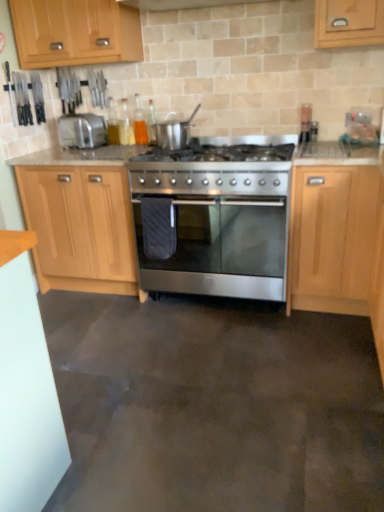
Question: Is stainless steel gas stove at center facing away from glossy wood cabinet at center, which is counted as the first cabinetry, starting from the right?

Choices:
 (A) yes
 (B) no

Answer: (B)

Question: From a real-world perspective, is stainless steel gas stove at center located higher than glossy wood cabinet at center, which is counted as the first cabinetry, starting from the right?

Choices:
 (A) no
 (B) yes

Answer: (B)

Question: From the image's perspective, is stainless steel gas stove at center over glossy wood cabinet at center, which is counted as the first cabinetry, starting from the right?

Choices:
 (A) no
 (B) yes

Answer: (B)

Question: Is stainless steel gas stove at center smaller than glossy wood cabinet at center, which is counted as the third cabinetry, starting from the left?

Choices:
 (A) yes
 (B) no

Answer: (A)

Question: Is the position of stainless steel gas stove at center less distant than that of glossy wood cabinet at center, which is counted as the third cabinetry, starting from the left?

Choices:
 (A) yes
 (B) no

Answer: (B)

Question: Is glossy wood cabinet at center, which is counted as the first cabinetry, starting from the right, a part of stainless steel gas stove at center?

Choices:
 (A) no
 (B) yes

Answer: (A)

Question: Does satin silver pot at center come in front of silver metallic toaster at left?

Choices:
 (A) yes
 (B) no

Answer: (A)

Question: Considering the relative sizes of satin silver pot at center and silver metallic toaster at left in the image provided, is satin silver pot at center taller than silver metallic toaster at left?

Choices:
 (A) no
 (B) yes

Answer: (B)

Question: Is silver metallic toaster at left completely or partially inside satin silver pot at center?

Choices:
 (A) yes
 (B) no

Answer: (B)

Question: Is satin silver pot at center further to the viewer compared to silver metallic toaster at left?

Choices:
 (A) yes
 (B) no

Answer: (B)

Question: Is satin silver pot at center positioned beyond the bounds of silver metallic toaster at left?

Choices:
 (A) no
 (B) yes

Answer: (B)

Question: Can you confirm if satin silver pot at center is shorter than silver metallic toaster at left?

Choices:
 (A) yes
 (B) no

Answer: (B)

Question: Is satin silver pot at center thinner than light wood/finish cabinet at upper left, arranged as the third cabinetry when viewed from the right?

Choices:
 (A) no
 (B) yes

Answer: (B)